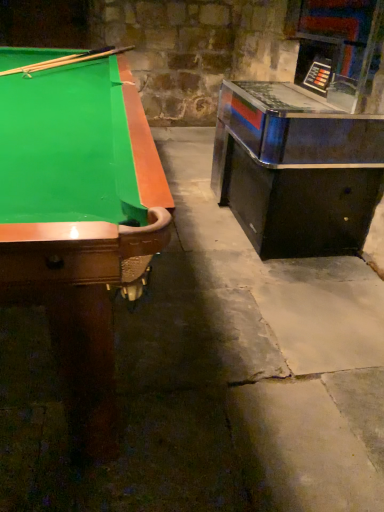
Question: Is wooden cue at upper left directly adjacent to metallic/reflective game machine at right?

Choices:
 (A) no
 (B) yes

Answer: (A)

Question: Is wooden cue at upper left turned away from metallic/reflective game machine at right?

Choices:
 (A) no
 (B) yes

Answer: (A)

Question: From a real-world perspective, is wooden cue at upper left over metallic/reflective game machine at right?

Choices:
 (A) yes
 (B) no

Answer: (A)

Question: Considering the relative sizes of wooden cue at upper left and metallic/reflective game machine at right in the image provided, is wooden cue at upper left bigger than metallic/reflective game machine at right?

Choices:
 (A) yes
 (B) no

Answer: (B)

Question: Is the position of wooden cue at upper left more distant than that of metallic/reflective game machine at right?

Choices:
 (A) yes
 (B) no

Answer: (A)

Question: Do you think wooden cue at upper left is within metallic/reflective game machine at right, or outside of it?

Choices:
 (A) inside
 (B) outside

Answer: (B)

Question: Visually, is wooden cue at upper left positioned to the left or to the right of metallic/reflective game machine at right?

Choices:
 (A) right
 (B) left

Answer: (B)

Question: Is point (99, 50) positioned closer to the camera than point (286, 120)?

Choices:
 (A) farther
 (B) closer

Answer: (A)

Question: From the image's perspective, is wooden cue at upper left above or below metallic/reflective game machine at right?

Choices:
 (A) above
 (B) below

Answer: (A)

Question: Is point (258, 227) closer or farther from the camera than point (119, 175)?

Choices:
 (A) closer
 (B) farther

Answer: (B)

Question: From their relative heights in the image, would you say metallic/reflective game machine at right is taller or shorter than green felt pool table at left?

Choices:
 (A) short
 (B) tall

Answer: (B)

Question: From a real-world perspective, relative to green felt pool table at left, is metallic/reflective game machine at right vertically above or below?

Choices:
 (A) below
 (B) above

Answer: (B)

Question: From the image's perspective, relative to green felt pool table at left, is metallic/reflective game machine at right above or below?

Choices:
 (A) above
 (B) below

Answer: (A)

Question: From a real-world perspective, relative to metallic/reflective game machine at right, is green felt pool table at left vertically above or below?

Choices:
 (A) below
 (B) above

Answer: (A)

Question: Considering their positions, is green felt pool table at left located in front of or behind metallic/reflective game machine at right?

Choices:
 (A) front
 (B) behind

Answer: (A)